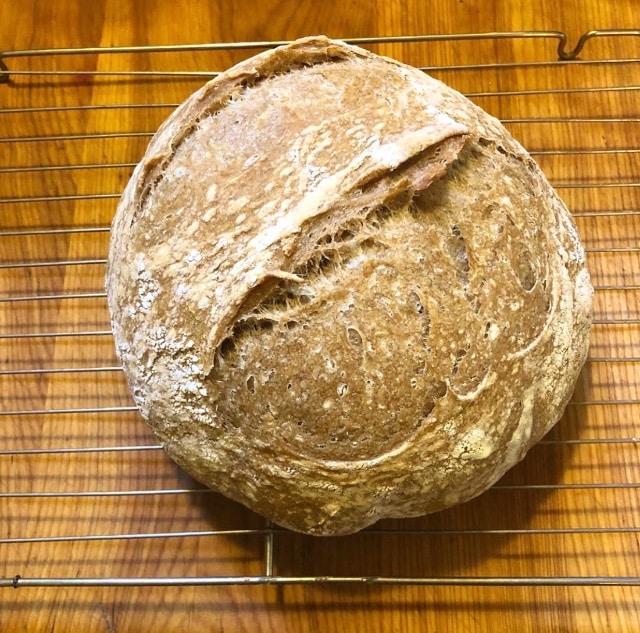
Locate an element on the screen. shadow on table bottom is located at coordinates (429, 553).